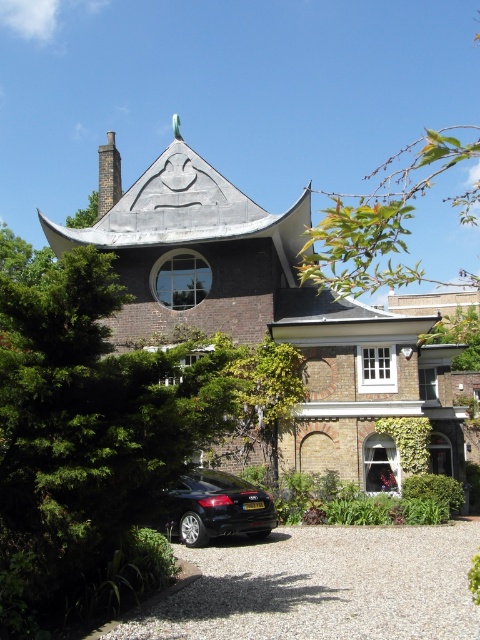
Does gravel driveway at lower center have a greater width compared to black matte car at lower center?

Correct, the width of gravel driveway at lower center exceeds that of black matte car at lower center.

Can you confirm if gravel driveway at lower center is bigger than black matte car at lower center?

Yes.

Where is `gravel driveway at lower center`? gravel driveway at lower center is located at coordinates (322, 588).

At what (x,y) coordinates should I click in order to perform the action: click on gravel driveway at lower center. Please return your answer as a coordinate pair (x, y). Looking at the image, I should click on (322, 588).

This screenshot has width=480, height=640. What do you see at coordinates (214, 508) in the screenshot? I see `black matte car at lower center` at bounding box center [214, 508].

Does black matte car at lower center have a greater height compared to dark gray stone chimney at upper left?

No.

Where is `black matte car at lower center`? black matte car at lower center is located at coordinates (214, 508).

Which is behind, point (239, 624) or point (104, 161)?

Positioned behind is point (104, 161).

Between gravel driveway at lower center and dark gray stone chimney at upper left, which one has less height?

gravel driveway at lower center

Is point (164, 612) positioned in front of point (106, 168)?

Yes.

The image size is (480, 640). What are the coordinates of `gravel driveway at lower center` in the screenshot? It's located at (322, 588).